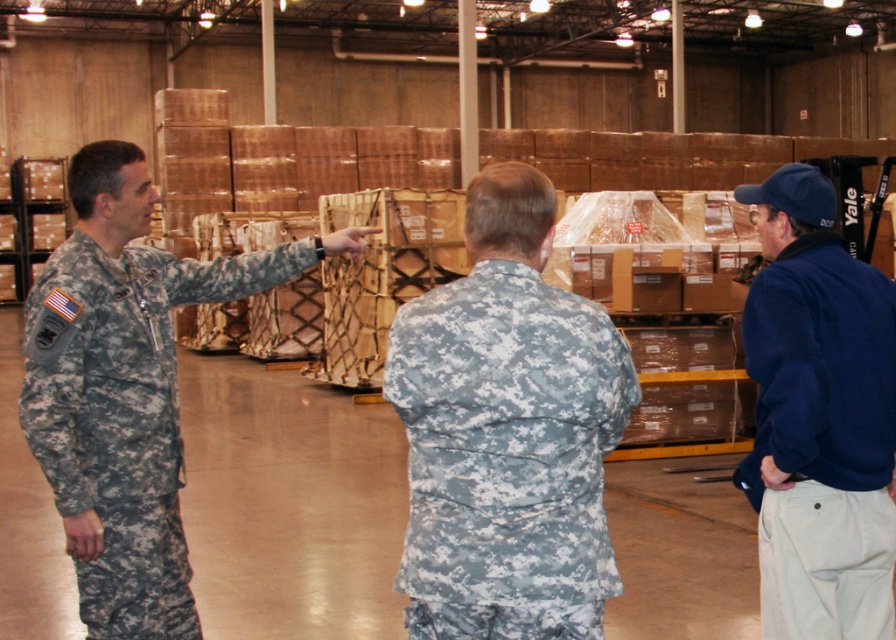
In the scene shown: You are a warehouse inspector standing at the entrance. You see a point marked at coordinates (506, 454). What object does this point indicate?

The point at coordinates (506, 454) indicates the digital camouflage uniform at center.

You are a drone operator controlling a drone that is 0.5 meters in height. You need to fly the drone to a point that is closer to the camera between the two points, point (490,509) and point (854,296). Which point should you fly the drone to?

You should fly the drone to point (490,509) because it is closer to the camera than point (854,296).

You are a security guard in the warehouse and need to check the distance between the blue fleece jacket at right and the camouflage fabric uniform at left. Which one is nearer to you?

The blue fleece jacket at right is closer to the viewer than the camouflage fabric uniform at left, so the blue fleece jacket at right is nearer to you.